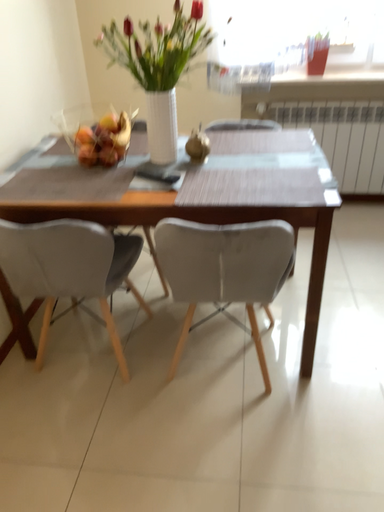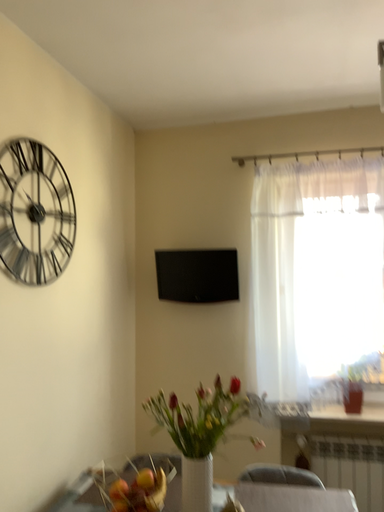
Question: Which way did the camera rotate in the video?

Choices:
 (A) rotated upward
 (B) rotated downward

Answer: (A)